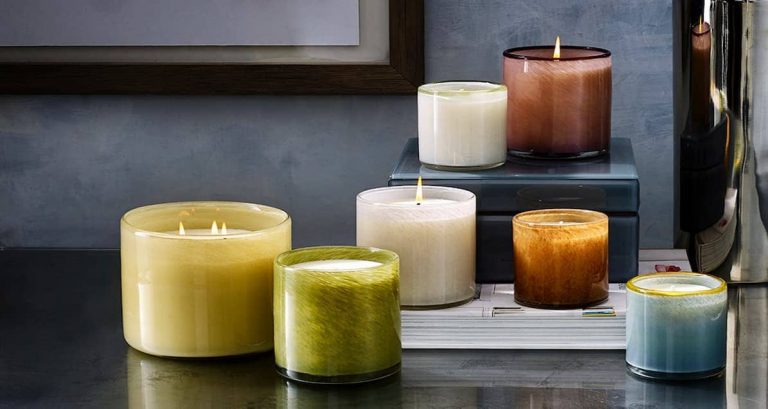
I want to click on candle, so click(x=233, y=230), click(x=348, y=310), click(x=422, y=216), click(x=468, y=110), click(x=551, y=81), click(x=561, y=211), click(x=690, y=304).